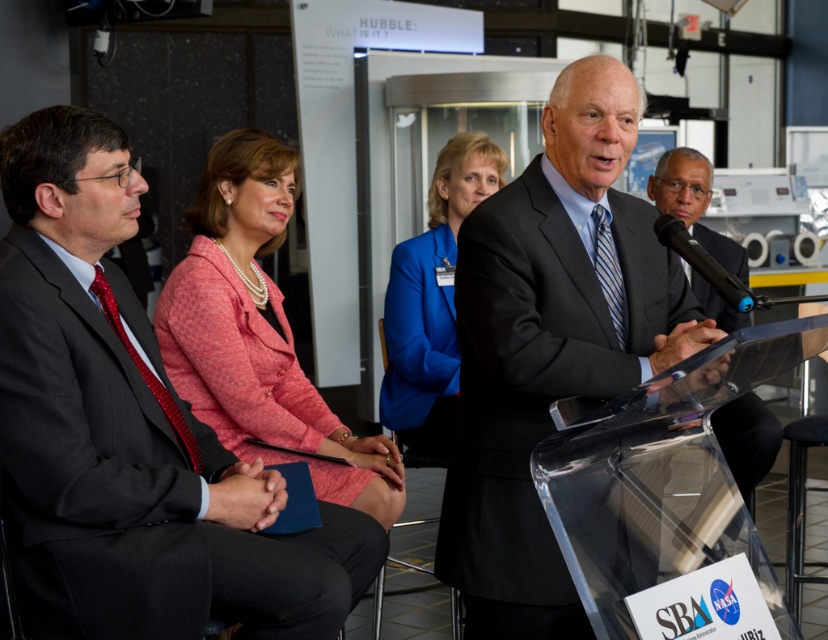
Question: Is dark gray pinstripe suit at left positioned in front of blue smooth blazer at center?

Choices:
 (A) yes
 (B) no

Answer: (A)

Question: Does matte black suit at center appear on the left side of blue fabric jacket at center?

Choices:
 (A) no
 (B) yes

Answer: (A)

Question: Based on their relative distances, which object is farther from the pink textured blazer at center?

Choices:
 (A) black glossy suit at center
 (B) blue fabric jacket at center
 (C) black plastic microphone at center

Answer: (A)

Question: Among these objects, which one is nearest to the camera?

Choices:
 (A) black glossy suit at center
 (B) blue smooth blazer at center

Answer: (B)

Question: Is blue smooth blazer at center thinner than black glossy suit at center?

Choices:
 (A) yes
 (B) no

Answer: (A)

Question: Which point is closer to the camera taking this photo?

Choices:
 (A) (705, 276)
 (B) (230, 170)
 (C) (347, 513)

Answer: (A)